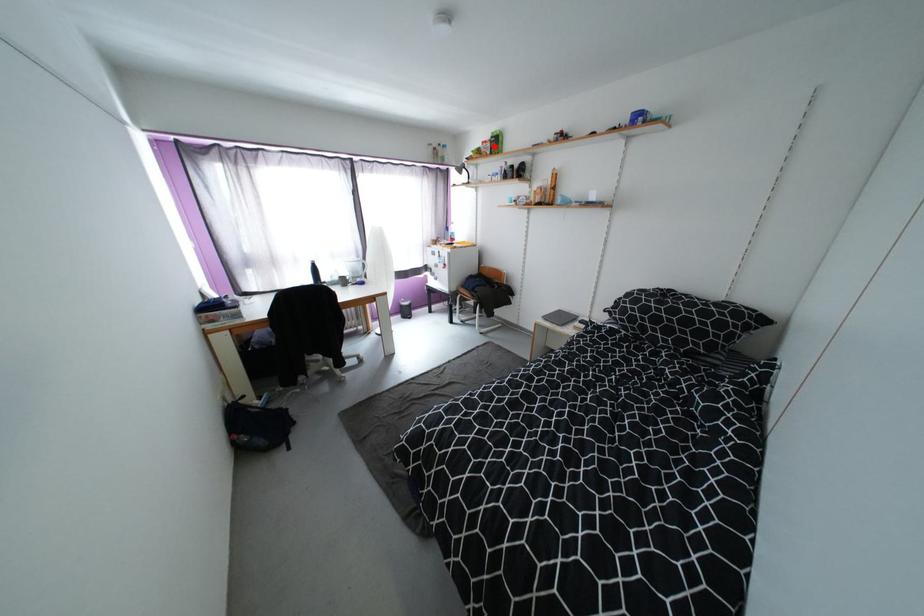
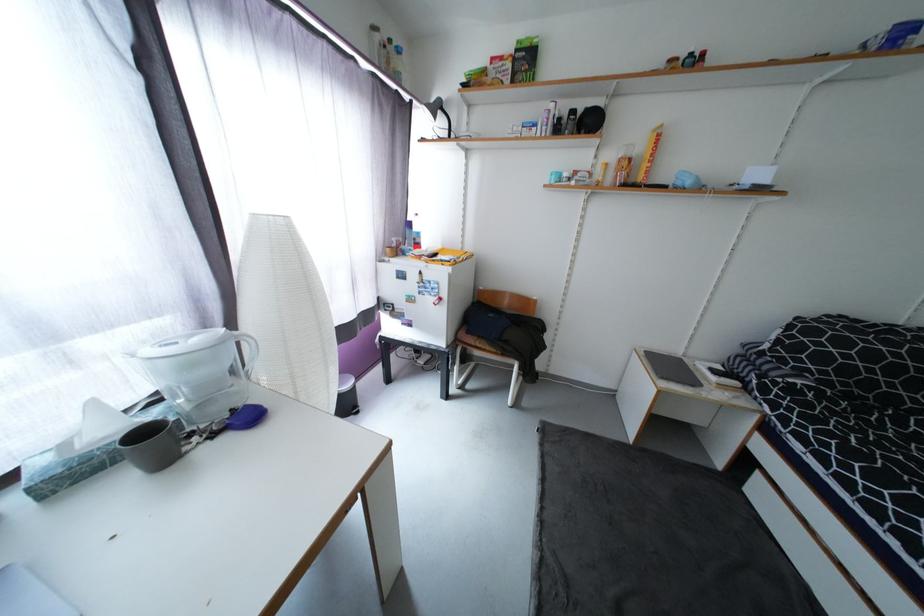
Question: A red point is marked in image1. In image2, is the corresponding 3D point closer to the camera or farther? Reply with the corresponding letter.

Choices:
 (A) The corresponding 3D point is closer.
 (B) The corresponding 3D point is farther.

Answer: (B)